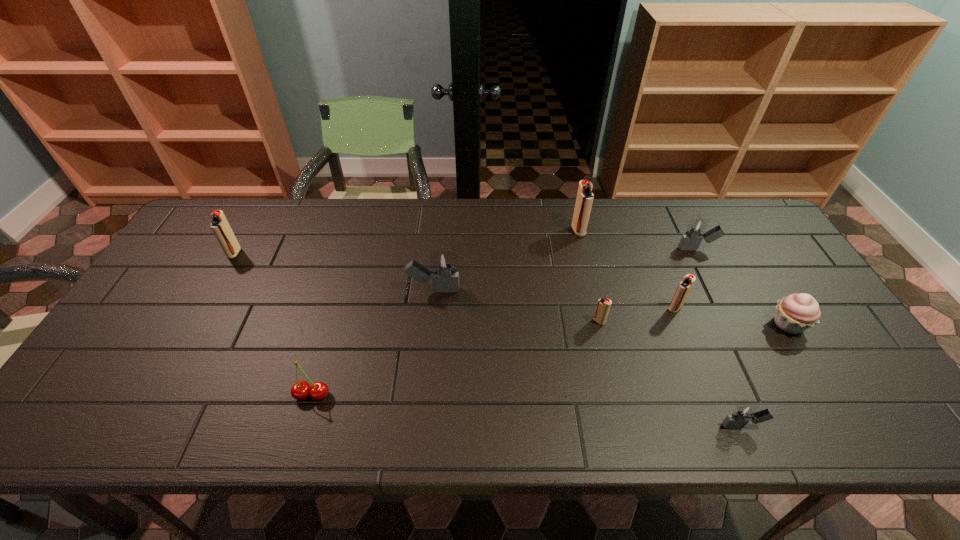
Where is `vacant space located on the front of the second biggest gray igniter`? vacant space located on the front of the second biggest gray igniter is located at coordinates (719, 293).

At what (x,y) coordinates should I click in order to perform the action: click on vacant space located on the front of the third nearest igniter. Please return your answer as a coordinate pair (x, y). The image size is (960, 540). Looking at the image, I should click on (700, 372).

I want to click on vacant area located 0.260m on the back of the cupcake, so click(x=739, y=245).

Where is `free spot located with the stems of the red cherry pointing upwards`? The height and width of the screenshot is (540, 960). free spot located with the stems of the red cherry pointing upwards is located at coordinates (303, 425).

Where is `free region located 0.210m on the back of the nearest red igniter`? Image resolution: width=960 pixels, height=540 pixels. free region located 0.210m on the back of the nearest red igniter is located at coordinates (585, 262).

Find the location of a particular element. The width and height of the screenshot is (960, 540). vacant region located 0.080m on the back of the nearest object is located at coordinates (724, 384).

Where is `cherry positioned at the near edge`? The height and width of the screenshot is (540, 960). cherry positioned at the near edge is located at coordinates (318, 391).

Where is `igniter that is at the near edge`? The height and width of the screenshot is (540, 960). igniter that is at the near edge is located at coordinates (744, 413).

The height and width of the screenshot is (540, 960). In order to click on object that is at the left edge in this screenshot , I will do `click(219, 224)`.

Locate an element on the screen. object that is at the right edge is located at coordinates (795, 313).